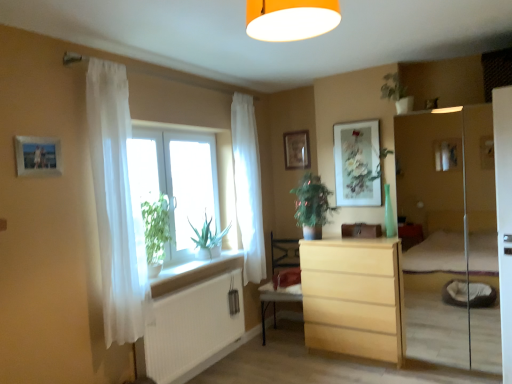
Question: Is green matte plant at upper center facing towards transparent glass window at center?

Choices:
 (A) no
 (B) yes

Answer: (A)

Question: Is green matte plant at upper center turned away from transparent glass window at center?

Choices:
 (A) no
 (B) yes

Answer: (A)

Question: From the image's perspective, is green matte plant at upper center below transparent glass window at center?

Choices:
 (A) no
 (B) yes

Answer: (A)

Question: Is green matte plant at upper center thinner than transparent glass window at center?

Choices:
 (A) yes
 (B) no

Answer: (B)

Question: From a real-world perspective, is green matte plant at upper center physically below transparent glass window at center?

Choices:
 (A) no
 (B) yes

Answer: (A)

Question: Is green matte plant at upper center not close to transparent glass window at center?

Choices:
 (A) yes
 (B) no

Answer: (A)

Question: Can you confirm if white ribbed radiator at lower left is thinner than wooden armchair at center?

Choices:
 (A) no
 (B) yes

Answer: (B)

Question: Is white ribbed radiator at lower left outside of wooden armchair at center?

Choices:
 (A) yes
 (B) no

Answer: (A)

Question: Considering the relative sizes of white ribbed radiator at lower left and wooden armchair at center in the image provided, is white ribbed radiator at lower left bigger than wooden armchair at center?

Choices:
 (A) no
 (B) yes

Answer: (A)

Question: Is white ribbed radiator at lower left facing towards wooden armchair at center?

Choices:
 (A) yes
 (B) no

Answer: (B)

Question: From the image's perspective, would you say white ribbed radiator at lower left is positioned over wooden armchair at center?

Choices:
 (A) no
 (B) yes

Answer: (A)

Question: Is white ribbed radiator at lower left taller than wooden armchair at center?

Choices:
 (A) yes
 (B) no

Answer: (B)

Question: Is white sheer curtain at window, which is the first curtain in back-to-front order, far away from light wood chest of drawers at center?

Choices:
 (A) no
 (B) yes

Answer: (A)